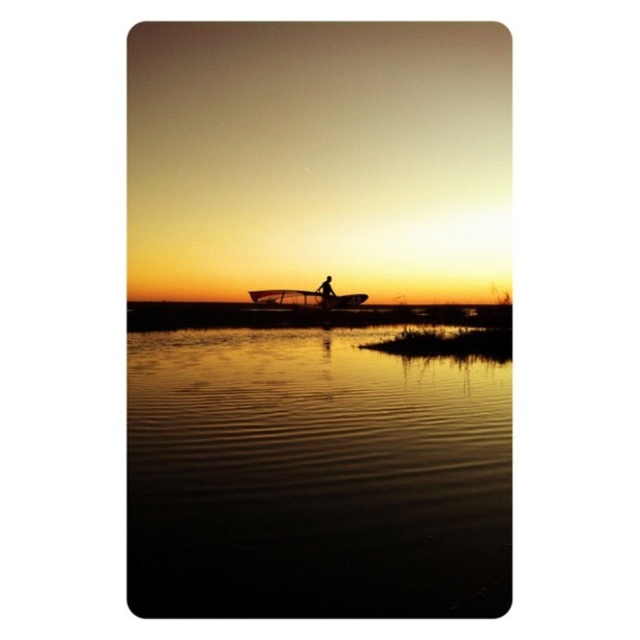
You are standing on the shore of the lake and see the metallic silver boat at center and the silhouette figure at center. Which object is closer to your right side?

The silhouette figure at center is closer to your right side because the metallic silver boat at center is to the left of it.

You are standing at the origin point in the image and looking towards the sunset. Which of the two points, point (264, 291) or point (328, 284), is closer to you?

Point (328, 284) is closer to you because it is in front of point (264, 291) according to their spatial arrangement.

You are a photographer trying to capture the sunset reflection on the water. Based on the scene, where should you position yourself to ensure the glossy reflective water at center is in the frame? Use the 2D coordinates provided to determine the best position.

The glossy reflective water at center is located at point (316,476). To capture its reflection, position yourself so that your camera is aligned with these coordinates, ensuring the water remains centered in your frame.